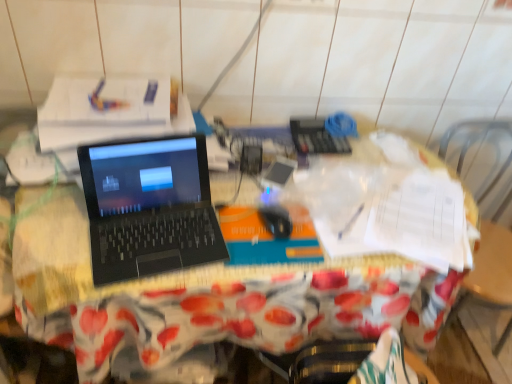
Locate an element on the screen. This screenshot has height=384, width=512. spots to the right of black matte mouse at center is located at coordinates [x=353, y=231].